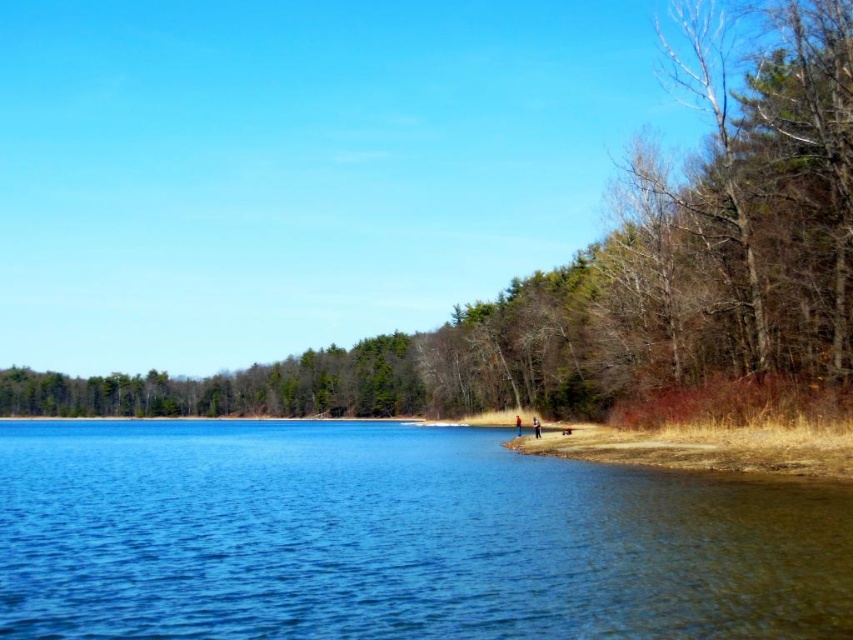
Question: Can you confirm if blue water at lower left is positioned below brown/dry wood at right?

Choices:
 (A) yes
 (B) no

Answer: (A)

Question: Which point appears farthest from the camera in this image?

Choices:
 (A) (711, 564)
 (B) (38, 392)

Answer: (B)

Question: Does blue water at lower left appear over brown/dry wood at right?

Choices:
 (A) no
 (B) yes

Answer: (A)

Question: Where is blue water at lower left located in relation to brown/dry wood at right in the image?

Choices:
 (A) right
 (B) left

Answer: (A)